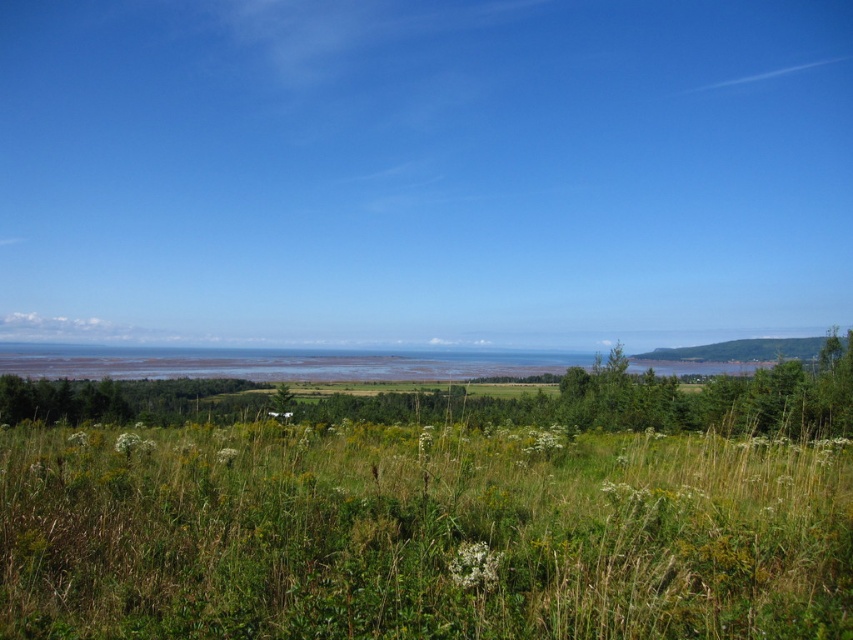
This screenshot has height=640, width=853. Describe the element at coordinates (419, 536) in the screenshot. I see `green grassy field at center` at that location.

Is green grassy field at center wider than green leafy tree at lower center?

No, green grassy field at center is not wider than green leafy tree at lower center.

You are a GUI agent. You are given a task and a screenshot of the screen. Output one action in this format:
    pyautogui.click(x=<x>, y=<y>)
    Task: Click on the green grassy field at center
    This screenshot has height=640, width=853.
    Given the screenshot: What is the action you would take?
    pyautogui.click(x=419, y=536)